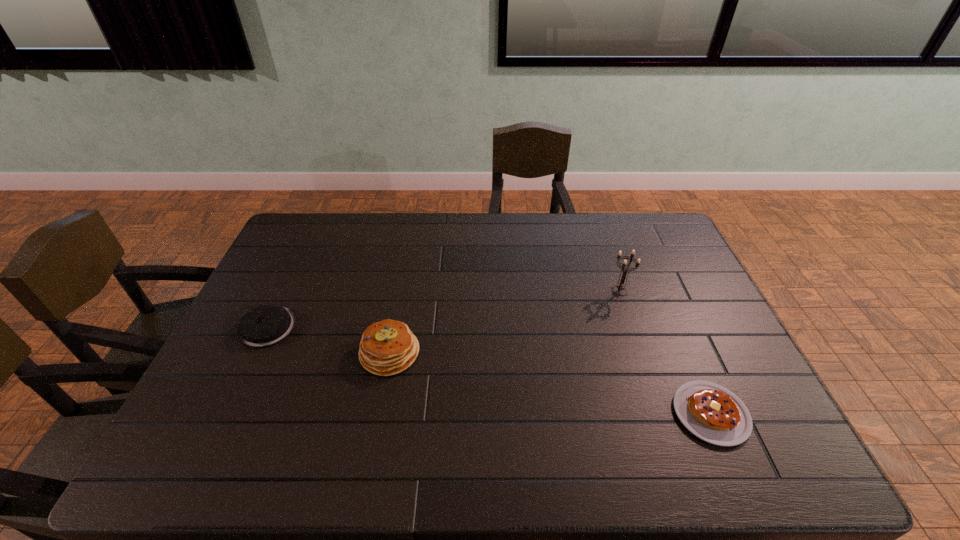
Locate an element on the screen. This screenshot has width=960, height=540. the tallest object is located at coordinates (624, 267).

The height and width of the screenshot is (540, 960). In order to click on candle holder in this screenshot , I will do `click(624, 267)`.

The image size is (960, 540). I want to click on the second object from left to right, so click(x=388, y=347).

Image resolution: width=960 pixels, height=540 pixels. I want to click on the second pancake from right to left, so click(x=388, y=347).

Where is `the third tallest object`? the third tallest object is located at coordinates (265, 325).

You are a GUI agent. You are given a task and a screenshot of the screen. Output one action in this format:
    pyautogui.click(x=<x>, y=<y>)
    Task: Click on the leftmost pancake
    The width and height of the screenshot is (960, 540).
    Given the screenshot: What is the action you would take?
    pyautogui.click(x=265, y=325)

Locate an element on the screen. the rightmost object is located at coordinates (711, 412).

What are the coordinates of `the shortest object` in the screenshot? It's located at (711, 412).

Where is `free location located 0.240m on the left of the farthest object`? This screenshot has width=960, height=540. free location located 0.240m on the left of the farthest object is located at coordinates (534, 292).

Find the location of a particular element. The width and height of the screenshot is (960, 540). vacant space located 0.160m on the back of the second pancake from left to right is located at coordinates (401, 292).